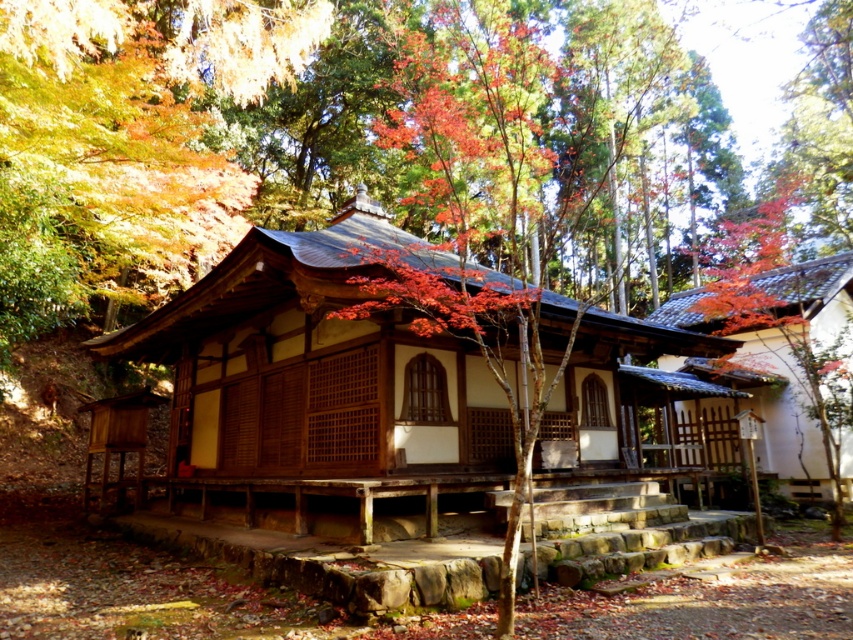
Consider the image. You are standing in the forest and see the wooden hut at center. If you want to reach it, in which direction should you walk from your current position?

The wooden hut at center is located at point (318, 392) in the image. Since the coordinate system is not specified, it is impossible to determine the exact direction to walk to reach it.

You are standing at the point marked as point (318, 392) and want to enter the wooden hut at center. Which direction should you walk to reach the entrance?

The wooden hut at center is located at point (318, 392), so you are already at the entrance of the wooden hut at center.